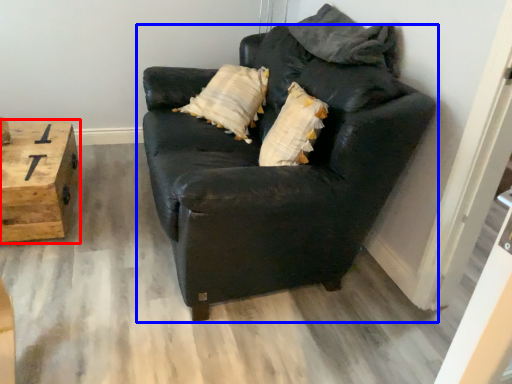
Question: Among these objects, which one is farthest to the camera, table (highlighted by a red box) or studio couch (highlighted by a blue box)?

Choices:
 (A) table
 (B) studio couch

Answer: (A)